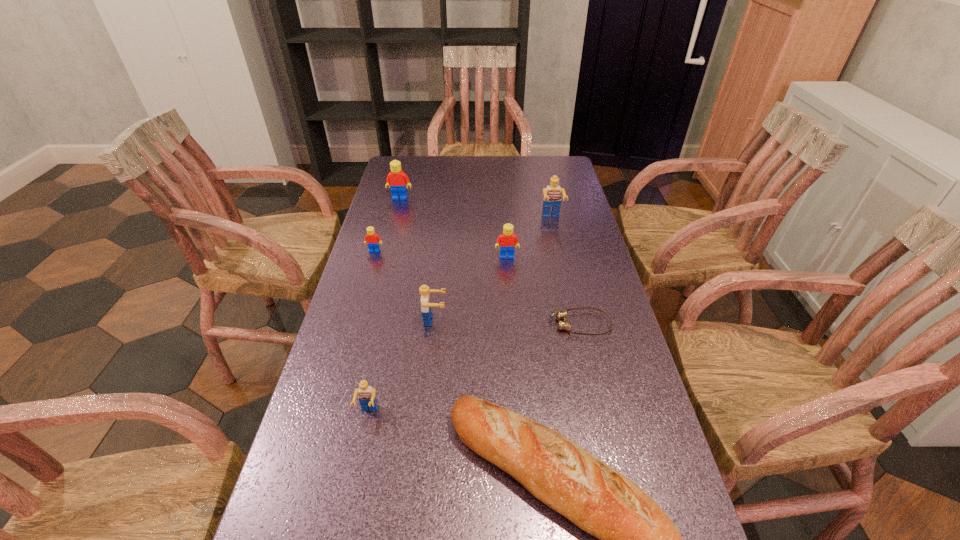
The width and height of the screenshot is (960, 540). Identify the location of the smallest blue Lego. (367, 398).

Find the location of a particular element. Image resolution: width=960 pixels, height=540 pixels. the nearest blue Lego is located at coordinates click(x=367, y=398).

This screenshot has width=960, height=540. What are the coordinates of `the shortest object` in the screenshot? It's located at (560, 315).

I want to click on vacant space located on the face of the farthest red Lego, so click(388, 244).

The height and width of the screenshot is (540, 960). What are the coordinates of `vacant space situated 0.190m on the face of the biggest blue Lego` in the screenshot? It's located at (561, 261).

This screenshot has height=540, width=960. I want to click on vacant point located 0.230m on the face of the second blue Lego from left to right, so 535,320.

Identify the location of vacant space located on the face of the fifth nearest object. The image size is (960, 540). (512, 317).

You are a GUI agent. You are given a task and a screenshot of the screen. Output one action in this format:
    pyautogui.click(x=<x>, y=<y>)
    Task: Click on the vacant space located 0.130m on the face of the second nearest red Lego
    The image size is (960, 540).
    Given the screenshot: What is the action you would take?
    pyautogui.click(x=366, y=281)

This screenshot has height=540, width=960. I want to click on vacant space situated on the face of the leftmost blue Lego, so click(361, 449).

At what (x,y) coordinates should I click in order to perform the action: click on free spot located 0.150m on the front lenses and sides of the shortest object. Please return your answer as a coordinate pair (x, y). The image size is (960, 540). Looking at the image, I should click on (492, 324).